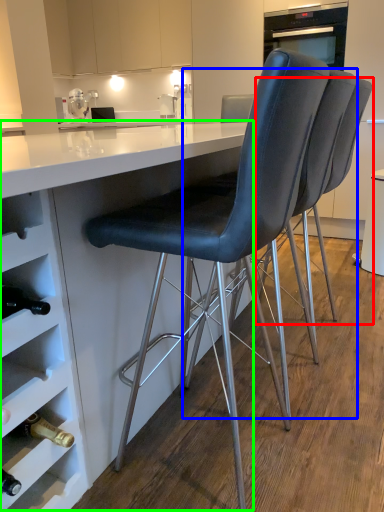
Question: Considering the real-world distances, which object is closest to chair (highlighted by a red box)? chair (highlighted by a blue box) or table (highlighted by a green box).

Choices:
 (A) chair
 (B) table

Answer: (A)